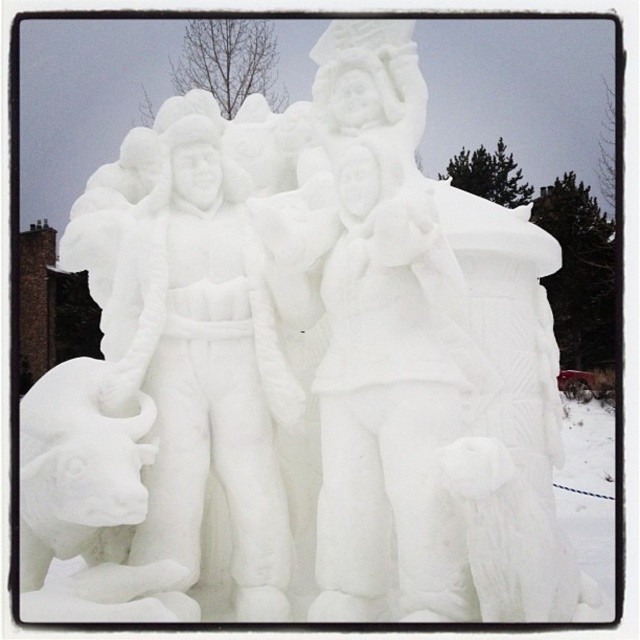
Question: Considering the relative positions of white snow sculpture at center and white snow bull at lower left in the image provided, where is white snow sculpture at center located with respect to white snow bull at lower left?

Choices:
 (A) right
 (B) left

Answer: (A)

Question: From the image, what is the correct spatial relationship of white snow sculpture at center in relation to white snow bull at lower left?

Choices:
 (A) right
 (B) left

Answer: (A)

Question: Is white snow sculpture at center positioned before white snow bull at lower left?

Choices:
 (A) yes
 (B) no

Answer: (B)